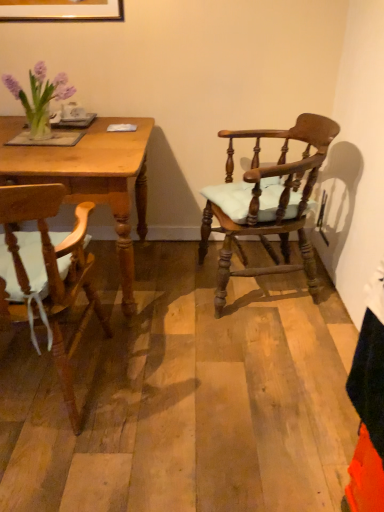
This screenshot has height=512, width=384. What do you see at coordinates (72, 112) in the screenshot? I see `white ceramic mug at upper left` at bounding box center [72, 112].

You are a GUI agent. You are given a task and a screenshot of the screen. Output one action in this format:
    pyautogui.click(x=<x>, y=<y>)
    Task: Click on the wooden table at left
    The width and height of the screenshot is (384, 512).
    Given the screenshot: What is the action you would take?
    pyautogui.click(x=91, y=178)

Describe the element at coordinates (46, 272) in the screenshot. I see `wooden chair with cushion at left, which is counted as the second chair, starting from the right` at that location.

Locate an element on the screen. Image resolution: width=384 pixels, height=512 pixels. wooden chair with cushion at right, placed as the second chair when sorted from left to right is located at coordinates (268, 203).

From a real-world perspective, which object rests below the other?

wooden chair with cushion at right, the 1th chair positioned from the right.

Considering the sizes of objects wooden chair with cushion at left, which is counted as the second chair, starting from the right, and wooden chair with cushion at right, placed as the second chair when sorted from left to right, in the image provided, who is thinner, wooden chair with cushion at left, which is counted as the second chair, starting from the right, or wooden chair with cushion at right, placed as the second chair when sorted from left to right,?

wooden chair with cushion at right, placed as the second chair when sorted from left to right, is thinner.

Considering the relative sizes of wooden chair with cushion at left, which is counted as the second chair, starting from the right, and wooden chair with cushion at right, placed as the second chair when sorted from left to right, in the image provided, is wooden chair with cushion at left, which is counted as the second chair, starting from the right, bigger than wooden chair with cushion at right, placed as the second chair when sorted from left to right,?

No, wooden chair with cushion at left, which is counted as the second chair, starting from the right, is not bigger than wooden chair with cushion at right, placed as the second chair when sorted from left to right.

From a real-world perspective, is white ceramic mug at upper left above or below wooden chair with cushion at right, placed as the second chair when sorted from left to right?

white ceramic mug at upper left is situated higher than wooden chair with cushion at right, placed as the second chair when sorted from left to right, in the real world.

How far apart are white ceramic mug at upper left and wooden chair with cushion at right, the 1th chair positioned from the right?

white ceramic mug at upper left is 38.96 inches from wooden chair with cushion at right, the 1th chair positioned from the right.

You are a GUI agent. You are given a task and a screenshot of the screen. Output one action in this format:
    pyautogui.click(x=<x>, y=<y>)
    Task: Click on the 2nd chair to the right when counting from the white ceramic mug at upper left
    The image size is (384, 512).
    Given the screenshot: What is the action you would take?
    point(268,203)

From their relative heights in the image, would you say white ceramic mug at upper left is taller or shorter than wooden chair with cushion at right, the 1th chair positioned from the right?

Considering their sizes, white ceramic mug at upper left has less height than wooden chair with cushion at right, the 1th chair positioned from the right.

Between white ceramic mug at upper left and wooden table at left, which one has larger size?

Bigger between the two is wooden table at left.

Would you say white ceramic mug at upper left is inside or outside wooden table at left?

white ceramic mug at upper left is not inside wooden table at left, it's outside.

Does point (78, 104) lie behind point (87, 145)?

Yes, point (78, 104) is farther from viewer.

How many degrees apart are the facing directions of white ceramic mug at upper left and wooden chair with cushion at left, which is counted as the second chair, starting from the right?

The angular difference between white ceramic mug at upper left and wooden chair with cushion at left, which is counted as the second chair, starting from the right, is 164 degrees.

From a real-world perspective, relative to wooden chair with cushion at left, which appears as the 1th chair when viewed from the left, is white ceramic mug at upper left vertically above or below?

white ceramic mug at upper left is situated higher than wooden chair with cushion at left, which appears as the 1th chair when viewed from the left, in the real world.

From the image's perspective, is white ceramic mug at upper left located beneath wooden chair with cushion at left, which appears as the 1th chair when viewed from the left?

No, from the image's perspective, white ceramic mug at upper left is not beneath wooden chair with cushion at left, which appears as the 1th chair when viewed from the left.

Looking at their sizes, would you say white ceramic mug at upper left is wider or thinner than wooden chair with cushion at left, which is counted as the second chair, starting from the right?

Clearly, white ceramic mug at upper left has less width compared to wooden chair with cushion at left, which is counted as the second chair, starting from the right.

From a real-world perspective, is wooden chair with cushion at right, placed as the second chair when sorted from left to right, on wooden table at left?

Yes, from a real-world perspective, wooden chair with cushion at right, placed as the second chair when sorted from left to right, is on top of wooden table at left.

Consider the image. In the image, is wooden chair with cushion at right, the 1th chair positioned from the right, on the left side or the right side of wooden table at left?

Clearly, wooden chair with cushion at right, the 1th chair positioned from the right, is on the right of wooden table at left in the image.

Is wooden chair with cushion at right, the 1th chair positioned from the right, located outside wooden table at left?

Indeed, wooden chair with cushion at right, the 1th chair positioned from the right, is completely outside wooden table at left.

Can you see wooden chair with cushion at right, placed as the second chair when sorted from left to right, touching wooden table at left?

There is a gap between wooden chair with cushion at right, placed as the second chair when sorted from left to right, and wooden table at left.

Choose the correct answer: Is wooden table at left inside wooden chair with cushion at right, placed as the second chair when sorted from left to right, or outside it?

The correct answer is: outside.

From the picture: Does wooden table at left come behind wooden chair with cushion at right, the 1th chair positioned from the right?

Yes, wooden table at left is further from the viewer.

Is wooden table at left at the right side of wooden chair with cushion at right, placed as the second chair when sorted from left to right?

No.

Can you tell me how much wooden table at left and wooden chair with cushion at right, placed as the second chair when sorted from left to right, differ in facing direction?

79.9 degrees separate the facing orientations of wooden table at left and wooden chair with cushion at right, placed as the second chair when sorted from left to right.

Considering the relative positions of wooden table at left and wooden chair with cushion at left, which is counted as the second chair, starting from the right, in the image provided, is wooden table at left to the right of wooden chair with cushion at left, which is counted as the second chair, starting from the right, from the viewer's perspective?

Incorrect, wooden table at left is not on the right side of wooden chair with cushion at left, which is counted as the second chair, starting from the right.

In the image, there is a wooden chair with cushion at left, which appears as the 1th chair when viewed from the left. Where is `desk below it (from a real-world perspective)`? desk below it (from a real-world perspective) is located at coordinates (91, 178).

Is point (7, 156) closer or farther from the camera than point (38, 214)?

Point (7, 156) is positioned farther from the camera compared to point (38, 214).

Are wooden table at left and wooden chair with cushion at left, which is counted as the second chair, starting from the right, beside each other?

No, wooden table at left is not making contact with wooden chair with cushion at left, which is counted as the second chair, starting from the right.

Identify the location of chair located behind the wooden chair with cushion at left, which appears as the 1th chair when viewed from the left. This screenshot has width=384, height=512. (268, 203).

Find the location of a particular element. This screenshot has height=512, width=384. coffee cup above the wooden chair with cushion at right, the 1th chair positioned from the right (from a real-world perspective) is located at coordinates (72, 112).

Looking at the image, which one is located further to wooden chair with cushion at right, the 1th chair positioned from the right, wooden table at left or white ceramic mug at upper left?

white ceramic mug at upper left.

Estimate the real-world distances between objects in this image. Which object is closer to white ceramic mug at upper left, wooden table at left or wooden chair with cushion at right, placed as the second chair when sorted from left to right?

wooden table at left.

When comparing their distances from wooden table at left, does wooden chair with cushion at right, the 1th chair positioned from the right, or white ceramic mug at upper left seem closer?

white ceramic mug at upper left lies closer to wooden table at left than the other object.

When comparing their distances from wooden chair with cushion at right, placed as the second chair when sorted from left to right, does wooden table at left or wooden chair with cushion at left, which appears as the 1th chair when viewed from the left, seem further?

wooden chair with cushion at left, which appears as the 1th chair when viewed from the left, is positioned further to the anchor wooden chair with cushion at right, placed as the second chair when sorted from left to right.

Based on their spatial positions, is wooden chair with cushion at right, the 1th chair positioned from the right, or wooden table at left further from white ceramic mug at upper left?

wooden chair with cushion at right, the 1th chair positioned from the right, lies further to white ceramic mug at upper left than the other object.

Based on the photo, when comparing their distances from wooden chair with cushion at left, which appears as the 1th chair when viewed from the left, does wooden chair with cushion at right, the 1th chair positioned from the right, or wooden table at left seem closer?

wooden table at left is positioned closer to the anchor wooden chair with cushion at left, which appears as the 1th chair when viewed from the left.

Considering their positions, is wooden chair with cushion at left, which is counted as the second chair, starting from the right, positioned further to wooden chair with cushion at right, placed as the second chair when sorted from left to right, than white ceramic mug at upper left?

white ceramic mug at upper left lies further to wooden chair with cushion at right, placed as the second chair when sorted from left to right, than the other object.

When comparing their distances from white ceramic mug at upper left, does wooden chair with cushion at right, the 1th chair positioned from the right, or wooden chair with cushion at left, which appears as the 1th chair when viewed from the left, seem further?

wooden chair with cushion at right, the 1th chair positioned from the right, lies further to white ceramic mug at upper left than the other object.

This screenshot has height=512, width=384. In order to click on chair situated between wooden table at left and wooden chair with cushion at right, placed as the second chair when sorted from left to right, from left to right in this screenshot , I will do `click(46, 272)`.

Locate an element on the screen. This screenshot has width=384, height=512. chair between wooden chair with cushion at left, which is counted as the second chair, starting from the right, and white ceramic mug at upper left from front to back is located at coordinates (268, 203).

Identify the location of desk between wooden chair with cushion at left, which appears as the 1th chair when viewed from the left, and white ceramic mug at upper left in the front-back direction. (91, 178).

Where is `coffee cup located between wooden table at left and wooden chair with cushion at right, placed as the second chair when sorted from left to right, in the left-right direction`? coffee cup located between wooden table at left and wooden chair with cushion at right, placed as the second chair when sorted from left to right, in the left-right direction is located at coordinates (72, 112).